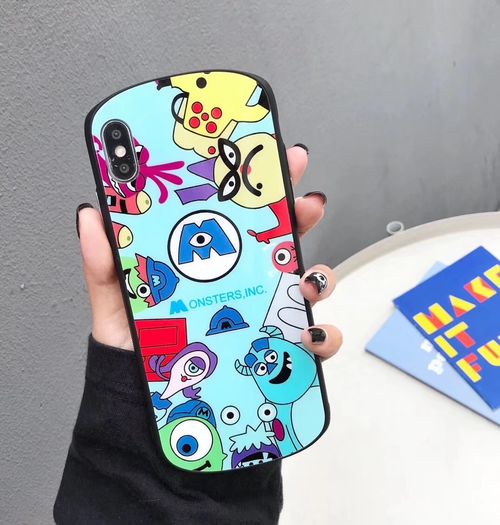
Where is `wall`? The image size is (500, 525). wall is located at coordinates tap(347, 89).